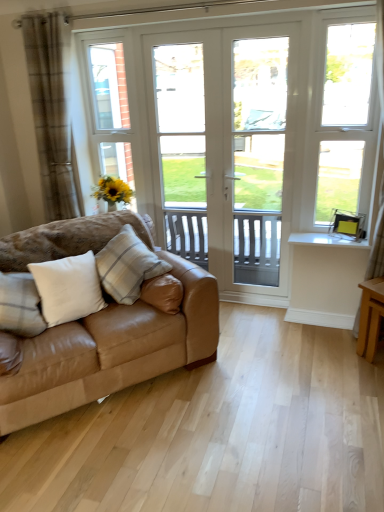
Question: Considering the relative positions of white soft cushion at left, which is the second pillow in right-to-left order, and white glossy door at center in the image provided, is white soft cushion at left, which is the second pillow in right-to-left order, to the left of white glossy door at center from the viewer's perspective?

Choices:
 (A) no
 (B) yes

Answer: (B)

Question: Is white soft cushion at left, acting as the 2th pillow starting from the left, taller than white glossy door at center?

Choices:
 (A) yes
 (B) no

Answer: (B)

Question: Is white soft cushion at left, which is the second pillow in right-to-left order, to the right of white glossy door at center from the viewer's perspective?

Choices:
 (A) no
 (B) yes

Answer: (A)

Question: From the image's perspective, does white soft cushion at left, acting as the 2th pillow starting from the left, appear higher than white glossy door at center?

Choices:
 (A) no
 (B) yes

Answer: (A)

Question: Is white soft cushion at left, which is the second pillow in right-to-left order, far away from white glossy door at center?

Choices:
 (A) no
 (B) yes

Answer: (B)

Question: From a real-world perspective, does white soft cushion at left, acting as the 2th pillow starting from the left, stand above white glossy door at center?

Choices:
 (A) yes
 (B) no

Answer: (B)

Question: Is brown plaid curtain at left inside white plastic window at right?

Choices:
 (A) yes
 (B) no

Answer: (B)

Question: Is white plastic window at right further to the viewer compared to brown plaid curtain at left?

Choices:
 (A) no
 (B) yes

Answer: (A)

Question: Is white plastic window at right to the right of brown plaid curtain at left from the viewer's perspective?

Choices:
 (A) no
 (B) yes

Answer: (B)

Question: Is white plastic window at right next to brown plaid curtain at left?

Choices:
 (A) no
 (B) yes

Answer: (A)

Question: Does white plastic window at right have a greater width compared to brown plaid curtain at left?

Choices:
 (A) no
 (B) yes

Answer: (A)

Question: From a real-world perspective, is white plastic window at right below brown plaid curtain at left?

Choices:
 (A) yes
 (B) no

Answer: (A)

Question: Can you confirm if white plastic window at right is shorter than white glossy window sill at lower right?

Choices:
 (A) yes
 (B) no

Answer: (B)